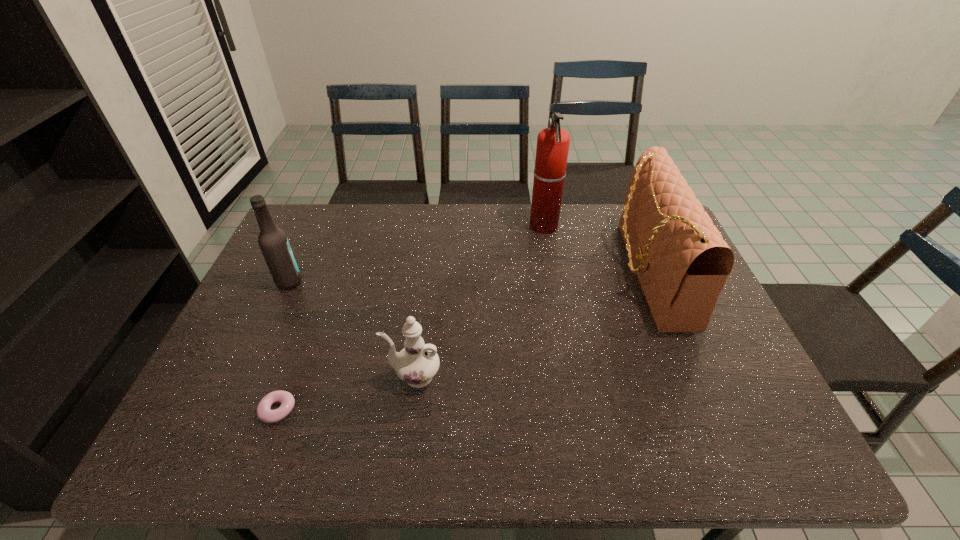
Where is `free space between the beer bottle and the handbag`? This screenshot has height=540, width=960. free space between the beer bottle and the handbag is located at coordinates (468, 278).

Where is `vacant point located between the second object from right to left and the fourth tallest object`? vacant point located between the second object from right to left and the fourth tallest object is located at coordinates (479, 301).

This screenshot has width=960, height=540. What are the coordinates of `vacant space that's between the leftmost object and the third object from left to right` in the screenshot? It's located at (351, 329).

Locate an element on the screen. The height and width of the screenshot is (540, 960). free point between the shortest object and the leftmost object is located at coordinates (283, 346).

Find the location of a particular element. This screenshot has width=960, height=540. free space between the fourth tallest object and the leftmost object is located at coordinates (351, 329).

Where is `free space between the doughnut and the beer bottle`? This screenshot has height=540, width=960. free space between the doughnut and the beer bottle is located at coordinates (283, 346).

Find the location of a particular element. The image size is (960, 540). vacant area that lies between the third object from right to left and the doughnut is located at coordinates (346, 393).

Where is `free space between the rightmost object and the doughnut`? free space between the rightmost object and the doughnut is located at coordinates (464, 342).

Identify the location of empty space between the handbag and the fire extinguisher. (596, 249).

Where is `vacant area that lies between the fourth tallest object and the leftmost object`? vacant area that lies between the fourth tallest object and the leftmost object is located at coordinates (351, 329).